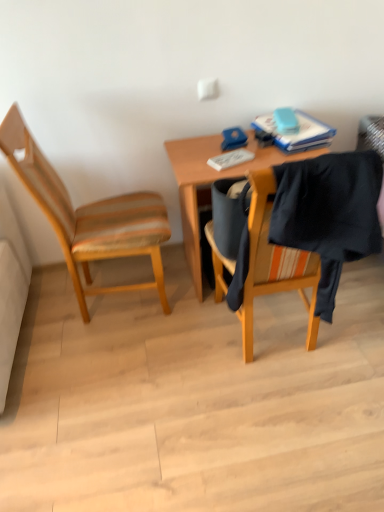
The height and width of the screenshot is (512, 384). I want to click on vacant area that is in front of wooden desk at center, so click(253, 355).